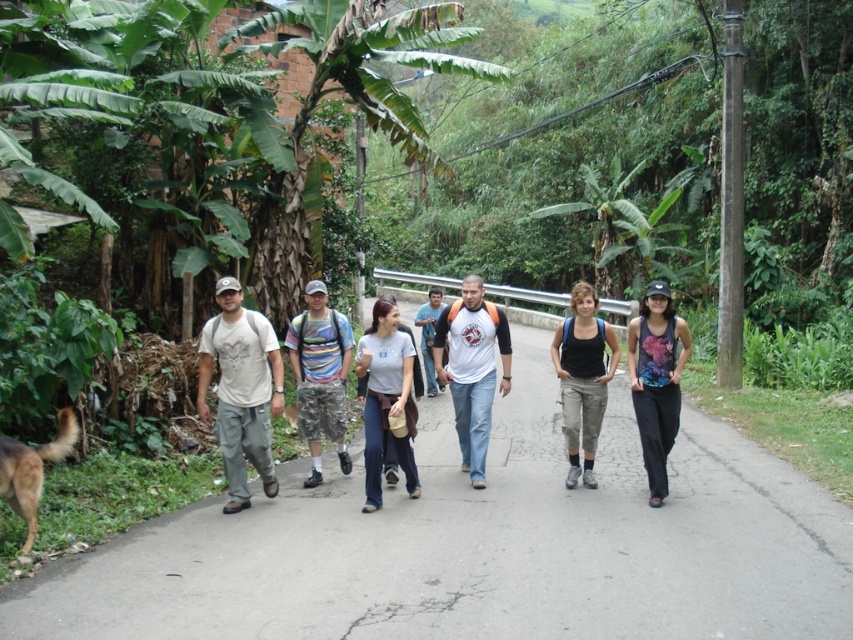
Does white cotton t-shirt at center have a smaller size compared to white t-shirt at center?

Indeed, white cotton t-shirt at center has a smaller size compared to white t-shirt at center.

Is point (486, 307) more distant than point (434, 305)?

No, (486, 307) is in front of (434, 305).

Is point (486, 429) less distant than point (440, 390)?

Yes, point (486, 429) is closer to viewer.

Identify the location of white cotton t-shirt at center. (473, 369).

Does striped fabric shirt at center have a lesser width compared to gray cotton t-shirt at center?

No, striped fabric shirt at center is not thinner than gray cotton t-shirt at center.

The width and height of the screenshot is (853, 640). Describe the element at coordinates (320, 376) in the screenshot. I see `striped fabric shirt at center` at that location.

Who is more distant from viewer, (306, 400) or (395, 406)?

The point (306, 400) is behind.

Locate an element on the screen. striped fabric shirt at center is located at coordinates (320, 376).

Can you confirm if gray asphalt road at center is thinner than black tank top at center?

Indeed, gray asphalt road at center has a lesser width compared to black tank top at center.

Who is shorter, gray asphalt road at center or black tank top at center?

gray asphalt road at center is shorter.

Find the location of a particular element. The width and height of the screenshot is (853, 640). gray asphalt road at center is located at coordinates (480, 545).